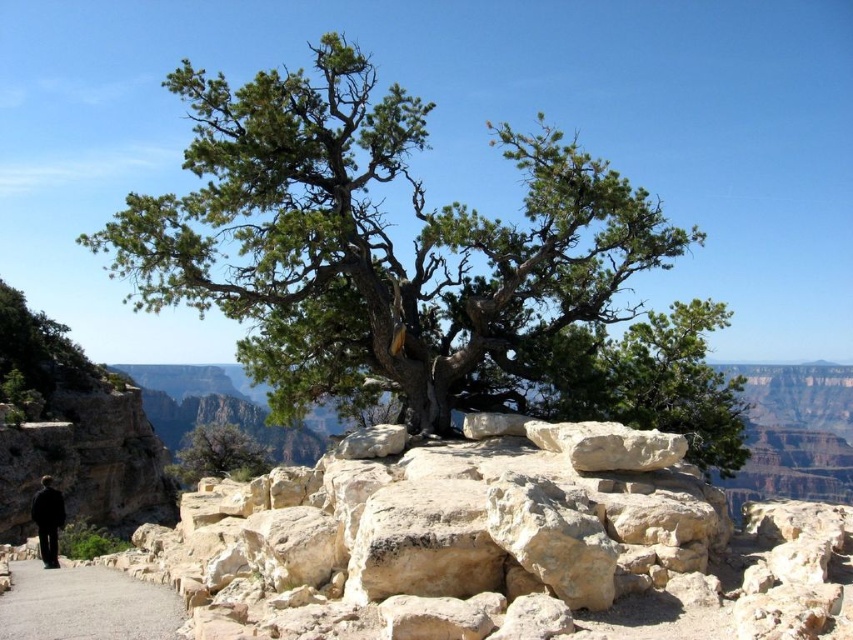
You are a hiker who wants to take a photo of the beige rock at center and the black fabric man at lower left. Which object should you focus on first if you want to capture both in the same frame without moving your camera?

The beige rock at center is much taller than the black fabric man at lower left, so focusing on the beige rock at center first will ensure both are in the frame as it occupies more space.

You are a geologist examining the rocks in the image. You have a measuring tool that can only fit objects wider than 20 cm. Based on the scene, can you determine if the green textured rock at center or the beige rock at center would be suitable for measurement with your tool?

The green textured rock at center has a larger width than the beige rock at center, so the green textured rock at center is wider and would be suitable for measurement with the tool since it exceeds the 20 cm requirement.

You are a geologist examining the rocks in this Grand Canyon scene. You have a measuring tool that can only measure up to 1 meter. The green textured rock at center and beige rock at center are both in your field of view. Which rock would your tool be able to measure fully without exceeding its limit?

The beige rock at center is shorter in height than the green textured rock at center. Since the measuring tool can only measure up to 1 meter, the beige rock at center can be measured fully without exceeding the limit, while the green textured rock at center might exceed it due to its greater height.